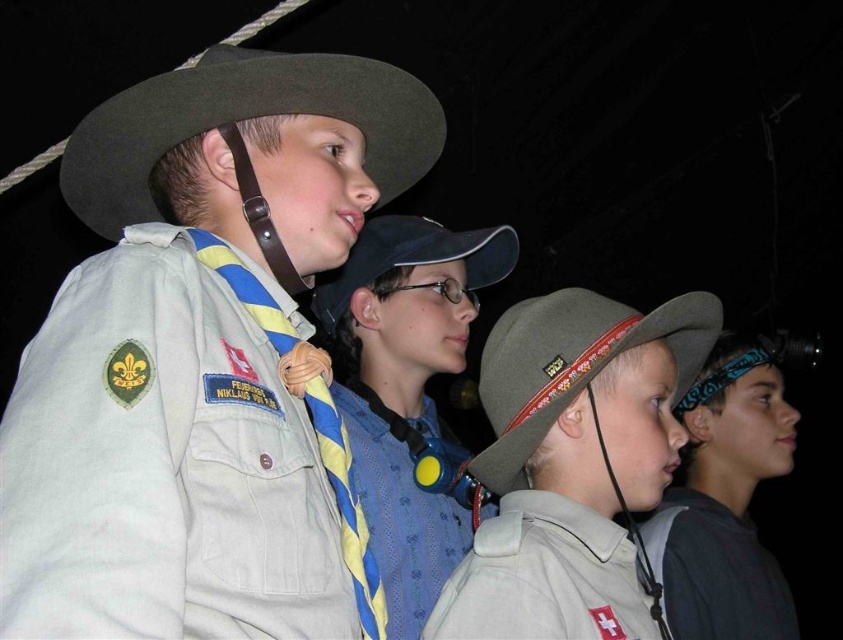
Question: Can you confirm if blue striped necktie at center is positioned below white matte uniform at center?

Choices:
 (A) yes
 (B) no

Answer: (B)

Question: Estimate the real-world distances between objects in this image. Which object is closer to the white matte uniform at center?

Choices:
 (A) matte brown cowboy hat at center
 (B) white cotton shirt at lower right

Answer: (B)

Question: Considering the relative positions of matte khaki uniform at center and green felt cowboy hat at upper left in the image provided, where is matte khaki uniform at center located with respect to green felt cowboy hat at upper left?

Choices:
 (A) below
 (B) above

Answer: (A)

Question: Considering the relative positions of white cotton shirt at lower right and matte brown cowboy hat at center in the image provided, where is white cotton shirt at lower right located with respect to matte brown cowboy hat at center?

Choices:
 (A) right
 (B) left

Answer: (A)

Question: Estimate the real-world distances between objects in this image. Which object is closer to the matte brown cowboy hat at center?

Choices:
 (A) blue fabric headband at right
 (B) matte khaki uniform at center
 (C) white matte uniform at center
 (D) blue striped necktie at center

Answer: (D)

Question: Which point is closer to the camera?

Choices:
 (A) white matte uniform at center
 (B) blue fabric headband at right
 (C) khaki fabric cowboy hat at center

Answer: (A)